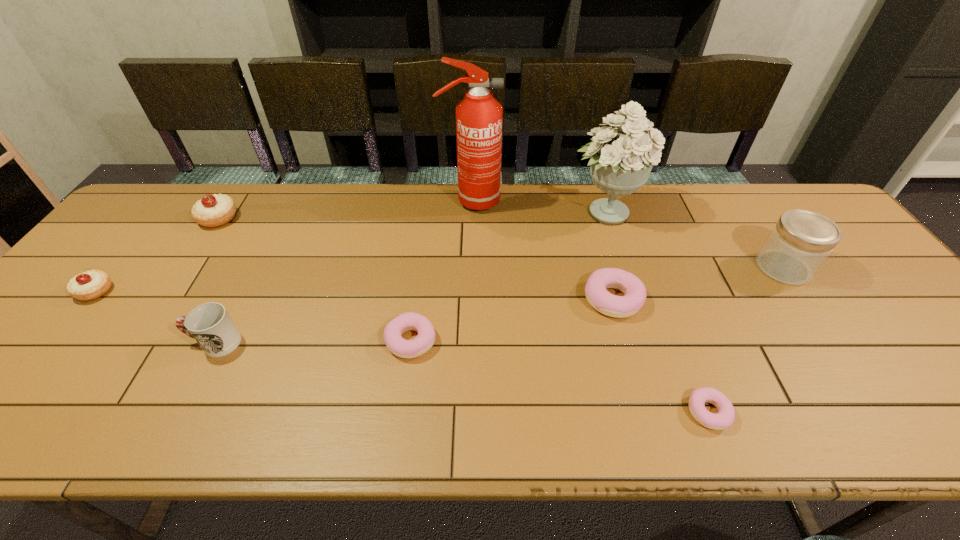
Where is `vacant area situated 0.130m on the left of the jar`? vacant area situated 0.130m on the left of the jar is located at coordinates (709, 268).

Where is `free space located on the handle side of the third object from left to right`? This screenshot has height=540, width=960. free space located on the handle side of the third object from left to right is located at coordinates (39, 342).

Locate an element on the screen. free space located 0.230m on the handle side of the third object from left to right is located at coordinates pos(91,342).

Find the location of a particular element. The width and height of the screenshot is (960, 540). free point located 0.150m on the handle side of the third object from left to right is located at coordinates (126, 342).

At what (x,y) coordinates should I click in order to perform the action: click on vacant region located on the back of the farther beige pastry. Please return your answer as a coordinate pair (x, y). The image size is (960, 540). Looking at the image, I should click on [x=233, y=195].

At what (x,y) coordinates should I click in order to perform the action: click on vacant space situated on the back of the smaller beige pastry. Please return your answer as a coordinate pair (x, y). This screenshot has width=960, height=540. Looking at the image, I should click on (149, 226).

The image size is (960, 540). In order to click on vacant space located 0.150m on the right of the third shortest pastry in this screenshot , I will do `click(702, 299)`.

Find the location of a particular element. Image resolution: width=960 pixels, height=540 pixels. vacant region located 0.280m on the right of the second shortest object is located at coordinates (557, 340).

Identify the location of free point located 0.230m on the back of the shortest pastry. (669, 309).

I want to click on fire extinguisher positioned at the far edge, so click(x=478, y=116).